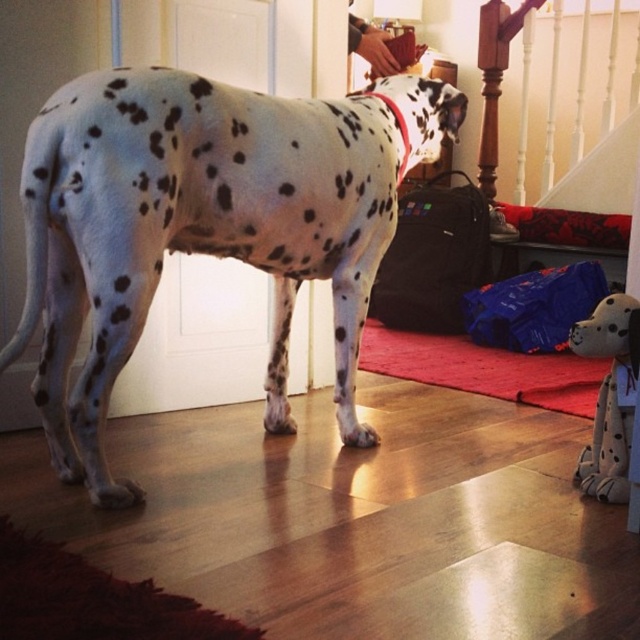
Question: Does white-spotted fur at center have a larger size compared to white plush dog at lower right?

Choices:
 (A) no
 (B) yes

Answer: (B)

Question: Which point is farther to the camera?

Choices:
 (A) white-spotted fur at center
 (B) white plush dog at lower right

Answer: (B)

Question: Is white-spotted fur at center bigger than white plush dog at lower right?

Choices:
 (A) no
 (B) yes

Answer: (B)

Question: Does white-spotted fur at center have a greater width compared to white plush dog at lower right?

Choices:
 (A) yes
 (B) no

Answer: (A)